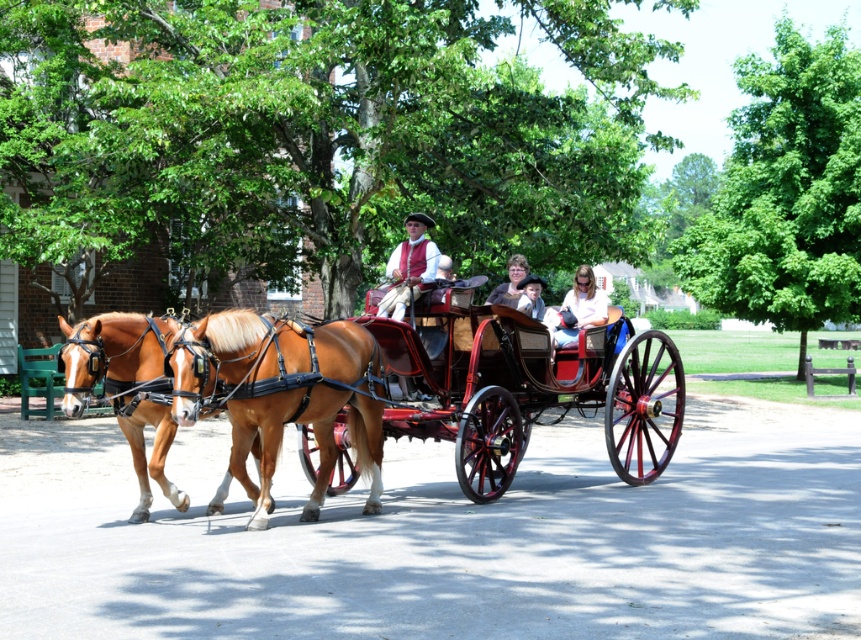
Question: Does brown glossy horse at left appear on the right side of smooth brown hair at center?

Choices:
 (A) no
 (B) yes

Answer: (A)

Question: Does light pink fabric at center have a greater width compared to smooth brown hair at center?

Choices:
 (A) yes
 (B) no

Answer: (B)

Question: Which of the following is the farthest from the observer?

Choices:
 (A) smooth brown hair at center
 (B) matte brown hair at center
 (C) shiny polished wood horse cart at center

Answer: (B)

Question: Estimate the real-world distances between objects in this image. Which object is farther from the shiny polished wood horse cart at center?

Choices:
 (A) light pink fabric at center
 (B) brown glossy horse at center
 (C) matte red vest at center

Answer: (A)

Question: Which is farther from the smooth brown hair at center?

Choices:
 (A) light pink fabric at center
 (B) matte red vest at center
 (C) brown glossy horse at left

Answer: (C)

Question: Is matte brown hair at center further to camera compared to smooth brown hair at center?

Choices:
 (A) yes
 (B) no

Answer: (A)